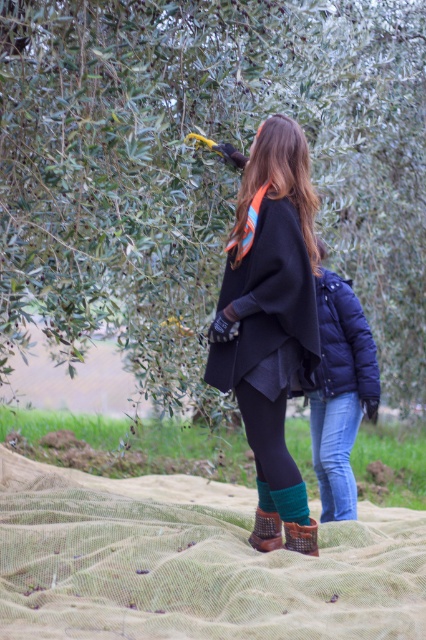
Question: Based on their relative distances, which object is nearer to the blue down jacket at center?

Choices:
 (A) dark blue puffer jacket at center
 (B) matte black coat at center
 (C) green leafy tree at upper center
 (D) green suede boot at lower center

Answer: (A)

Question: Which point is farther from the camera taking this photo?

Choices:
 (A) (95, 560)
 (B) (348, 506)
 (C) (298, 534)
 (D) (183, 404)

Answer: (D)

Question: Considering the real-world distances, which object is closest to the brown suede boot at lower center?

Choices:
 (A) dark blue puffer jacket at center
 (B) green leafy tree at upper center
 (C) matte black coat at center

Answer: (C)

Question: From the image, what is the correct spatial relationship of green leafy tree at upper center in relation to dark woolen cape at center?

Choices:
 (A) right
 (B) left

Answer: (B)

Question: Is green leafy tree at upper center to the left of matte black coat at center from the viewer's perspective?

Choices:
 (A) no
 (B) yes

Answer: (B)

Question: Is matte black coat at center wider than dark woolen cape at center?

Choices:
 (A) yes
 (B) no

Answer: (B)